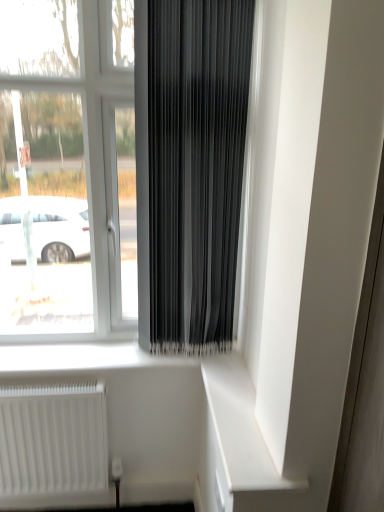
You are a GUI agent. You are given a task and a screenshot of the screen. Output one action in this format:
    pyautogui.click(x=<x>, y=<y>)
    Task: Click on the vacant area on top of white matte radiator at lower left (from a real-world perspective)
    The image size is (384, 512).
    Given the screenshot: What is the action you would take?
    pyautogui.click(x=48, y=372)